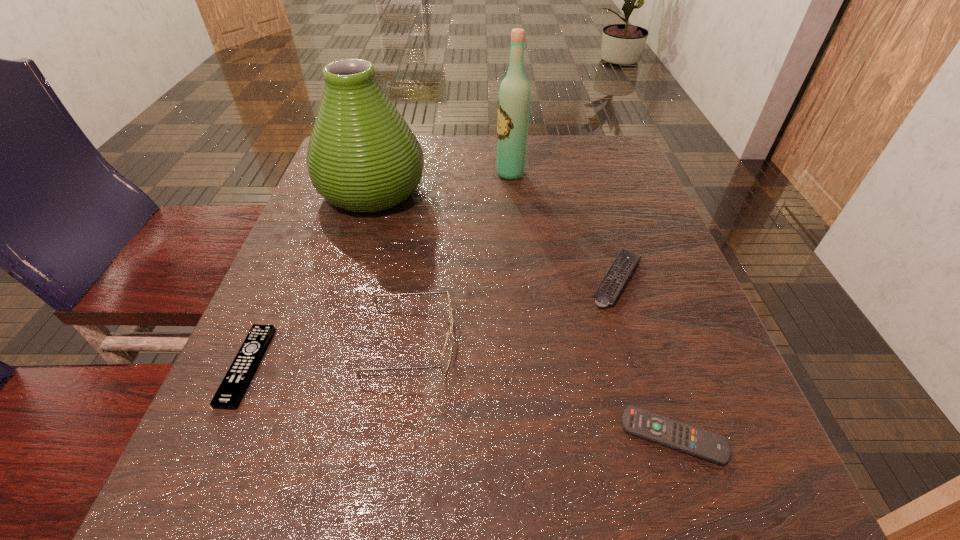
Locate an element on the screen. The width and height of the screenshot is (960, 540). the fourth object from left to right is located at coordinates (514, 98).

This screenshot has width=960, height=540. What are the coordinates of `the second tallest object` in the screenshot? It's located at (362, 156).

Locate an element on the screen. Image resolution: width=960 pixels, height=540 pixels. the fourth shortest object is located at coordinates (447, 351).

Where is `the farthest remote control`? The height and width of the screenshot is (540, 960). the farthest remote control is located at coordinates (x=611, y=285).

At what (x,y) coordinates should I click in order to perform the action: click on the tallest remote control. Please return your answer as a coordinate pair (x, y). Looking at the image, I should click on (611, 285).

Identify the location of the leftmost remote control. [232, 388].

The width and height of the screenshot is (960, 540). Find the location of `vacant space situated 0.290m on the front-facing side of the wine bottle`. vacant space situated 0.290m on the front-facing side of the wine bottle is located at coordinates (378, 173).

The image size is (960, 540). Find the location of `free location located on the front-facing side of the wine bottle`. free location located on the front-facing side of the wine bottle is located at coordinates (386, 173).

This screenshot has height=540, width=960. Find the location of `free location located 0.260m on the front-facing side of the wine bottle`. free location located 0.260m on the front-facing side of the wine bottle is located at coordinates (391, 173).

At what (x,y) coordinates should I click in order to perform the action: click on free space located 0.160m on the right of the vase. Please return your answer as a coordinate pair (x, y). Looking at the image, I should click on coord(494,191).